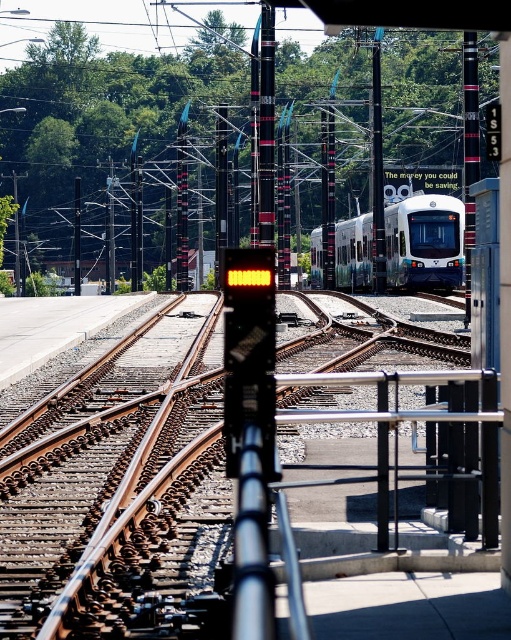
Which is below, black glossy pole at center or black metal pole at left?

Positioned lower is black glossy pole at center.

The height and width of the screenshot is (640, 511). I want to click on black glossy pole at center, so click(266, 129).

Find the location of a particular element. The height and width of the screenshot is (640, 511). black glossy pole at center is located at coordinates (266, 129).

Is point (450, 269) positioned in front of point (77, 184)?

Yes, it is in front of point (77, 184).

Does point (313, 232) come in front of point (75, 225)?

Yes, point (313, 232) is in front of point (75, 225).

You are a GUI agent. You are given a task and a screenshot of the screen. Output one action in this format:
    pyautogui.click(x=<x>, y=<y>)
    Task: Click on the white glossy passenger train at center
    The height and width of the screenshot is (640, 511).
    Given the screenshot: What is the action you would take?
    pyautogui.click(x=425, y=243)

This screenshot has width=511, height=640. In order to click on metallic pole at center in this screenshot , I will do `click(378, 172)`.

Find the location of `metallic pole at center`. metallic pole at center is located at coordinates (378, 172).